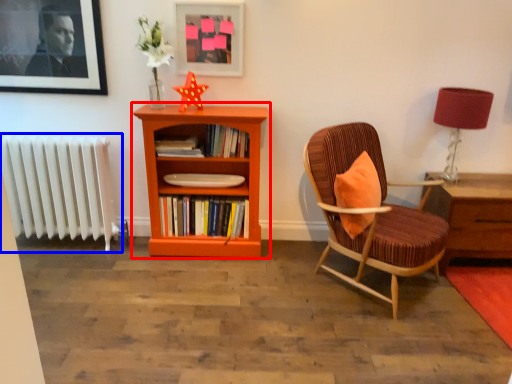
Question: Which point is closer to the camera, bookcase (highlighted by a red box) or radiator (highlighted by a blue box)?

Choices:
 (A) bookcase
 (B) radiator

Answer: (A)